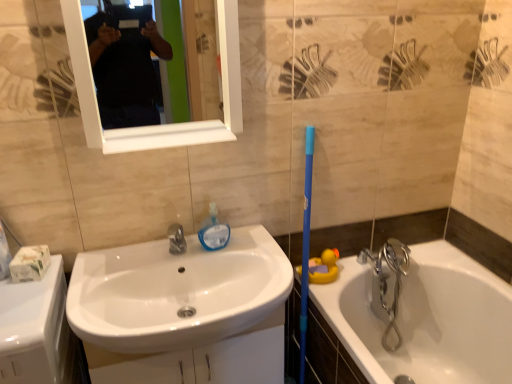
Image resolution: width=512 pixels, height=384 pixels. Describe the element at coordinates (426, 319) in the screenshot. I see `white glossy bathtub at right` at that location.

Image resolution: width=512 pixels, height=384 pixels. Describe the element at coordinates (36, 329) in the screenshot. I see `white glossy counter top at lower left` at that location.

What is the approximate width of chrome metallic faucet at right?

chrome metallic faucet at right is 8.96 inches wide.

Locate an element on the screen. The height and width of the screenshot is (384, 512). white glossy sink at center is located at coordinates (176, 292).

Is translucent plastic soap dispenser at center spatially inside yellow rubber duck at lower right, or outside of it?

translucent plastic soap dispenser at center is not enclosed by yellow rubber duck at lower right.

Considering the relative sizes of translucent plastic soap dispenser at center and yellow rubber duck at lower right in the image provided, is translucent plastic soap dispenser at center shorter than yellow rubber duck at lower right?

In fact, translucent plastic soap dispenser at center may be taller than yellow rubber duck at lower right.

From the image's perspective, would you say translucent plastic soap dispenser at center is shown under yellow rubber duck at lower right?

No, from the image's perspective, translucent plastic soap dispenser at center is not below yellow rubber duck at lower right.

You are a GUI agent. You are given a task and a screenshot of the screen. Output one action in this format:
    pyautogui.click(x=<x>, y=<y>)
    Task: Click on the soap dispenser above the yellow rubber duck at lower right (from the image's perspective)
    The width and height of the screenshot is (512, 384).
    Given the screenshot: What is the action you would take?
    pyautogui.click(x=214, y=231)

From a real-world perspective, who is located lower, white glossy mirror at upper center or chrome metallic faucet at right?

From a 3D spatial view, chrome metallic faucet at right is below.

Can you confirm if white glossy mirror at upper center is thinner than chrome metallic faucet at right?

Indeed, white glossy mirror at upper center has a lesser width compared to chrome metallic faucet at right.

Considering the relative positions of white glossy mirror at upper center and chrome metallic faucet at right in the image provided, is white glossy mirror at upper center to the right of chrome metallic faucet at right from the viewer's perspective?

No.

From the image's perspective, which one is positioned higher, white glossy mirror at upper center or chrome metallic faucet at right?

white glossy mirror at upper center appears higher in the image.

Is point (273, 303) positioned after point (211, 234)?

No.

Is white glossy sink at center oriented away from translucent plastic soap dispenser at center?

white glossy sink at center does not have its back to translucent plastic soap dispenser at center.

The width and height of the screenshot is (512, 384). I want to click on soap dispenser above the white glossy sink at center (from a real-world perspective), so click(x=214, y=231).

Is white glossy sink at center beside translucent plastic soap dispenser at center?

No, white glossy sink at center is not next to translucent plastic soap dispenser at center.

Can you confirm if white glossy mirror at upper center is bigger than yellow rubber duck at lower right?

Correct, white glossy mirror at upper center is larger in size than yellow rubber duck at lower right.

From a real-world perspective, is white glossy mirror at upper center located higher than yellow rubber duck at lower right?

Correct, in the physical world, white glossy mirror at upper center is higher than yellow rubber duck at lower right.

Find the location of `toy behind the white glossy mirror at upper center`. toy behind the white glossy mirror at upper center is located at coordinates (323, 267).

Based on the photo, would you say white glossy mirror at upper center is inside or outside yellow rubber duck at lower right?

white glossy mirror at upper center exists outside the volume of yellow rubber duck at lower right.

Is white glossy bathtub at right turned away from translucent plastic soap dispenser at center?

No, white glossy bathtub at right is not facing away from translucent plastic soap dispenser at center.

Would you say white glossy bathtub at right is a long distance from translucent plastic soap dispenser at center?

No, there isn't a large distance between white glossy bathtub at right and translucent plastic soap dispenser at center.

In order to click on bathtub below the translucent plastic soap dispenser at center (from a real-world perspective) in this screenshot , I will do `click(426, 319)`.

This screenshot has height=384, width=512. Identify the location of mirror that is above the translucent plastic soap dispenser at center (from the image's perspective). (182, 59).

How far apart are white glossy mirror at upper center and translucent plastic soap dispenser at center?

They are 1.57 meters apart.

Considering the sizes of objects white glossy mirror at upper center and translucent plastic soap dispenser at center in the image provided, who is wider, white glossy mirror at upper center or translucent plastic soap dispenser at center?

white glossy mirror at upper center.

From a real-world perspective, is white glossy mirror at upper center over translucent plastic soap dispenser at center?

Indeed, from a real-world perspective, white glossy mirror at upper center stands above translucent plastic soap dispenser at center.

From a real-world perspective, is translucent plastic soap dispenser at center positioned over white glossy sink at center based on gravity?

Yes, from a real-world perspective, translucent plastic soap dispenser at center is on top of white glossy sink at center.

Does translucent plastic soap dispenser at center have a lesser height compared to white glossy sink at center?

Indeed, translucent plastic soap dispenser at center has a lesser height compared to white glossy sink at center.

Is translucent plastic soap dispenser at center aimed at white glossy sink at center?

No, translucent plastic soap dispenser at center is not aimed at white glossy sink at center.

Which object is wider, translucent plastic soap dispenser at center or white glossy sink at center?

white glossy sink at center is wider.

Where is `soap dispenser above the yellow rubber duck at lower right (from a real-world perspective)`? soap dispenser above the yellow rubber duck at lower right (from a real-world perspective) is located at coordinates (214, 231).

You are a GUI agent. You are given a task and a screenshot of the screen. Output one action in this format:
    pyautogui.click(x=<x>, y=<y>)
    Task: Click on the tap on the right of white glossy mirror at upper center
    
    Given the screenshot: What is the action you would take?
    pyautogui.click(x=388, y=278)

Based on their spatial positions, is white glossy counter top at lower left or translucent plastic soap dispenser at center closer to yellow rubber duck at lower right?

translucent plastic soap dispenser at center lies closer to yellow rubber duck at lower right than the other object.

When comparing their distances from chrome metallic faucet at right, does white glossy mirror at upper center or translucent plastic soap dispenser at center seem closer?

Based on the image, translucent plastic soap dispenser at center appears to be nearer to chrome metallic faucet at right.

Which object lies nearer to the anchor point chrome metallic faucet at right, yellow rubber duck at lower right or white glossy mirror at upper center?

yellow rubber duck at lower right is closer to chrome metallic faucet at right.

Which object lies further to the anchor point white glossy sink at center, white glossy bathtub at right or white glossy counter top at lower left?

white glossy bathtub at right.

Estimate the real-world distances between objects in this image. Which object is further from chrome metallic faucet at right, white glossy bathtub at right or yellow rubber duck at lower right?

yellow rubber duck at lower right lies further to chrome metallic faucet at right than the other object.

Estimate the real-world distances between objects in this image. Which object is further from white glossy mirror at upper center, yellow rubber duck at lower right or translucent plastic soap dispenser at center?

yellow rubber duck at lower right is positioned further to the anchor white glossy mirror at upper center.

Estimate the real-world distances between objects in this image. Which object is closer to white glossy bathtub at right, white glossy sink at center or translucent plastic soap dispenser at center?

white glossy sink at center.

From the picture: Looking at the image, which one is located closer to translucent plastic soap dispenser at center, white glossy counter top at lower left or white glossy mirror at upper center?

The object closer to translucent plastic soap dispenser at center is white glossy counter top at lower left.

What are the coordinates of `toy between white glossy sink at center and white glossy bathtub at right from left to right` in the screenshot? It's located at (323, 267).

This screenshot has height=384, width=512. I want to click on toy between white glossy counter top at lower left and white glossy bathtub at right, so click(x=323, y=267).

This screenshot has width=512, height=384. I want to click on soap dispenser between white glossy mirror at upper center and white glossy counter top at lower left in the vertical direction, so click(214, 231).

Identify the location of sink between white glossy counter top at lower left and translucent plastic soap dispenser at center from left to right. (176, 292).